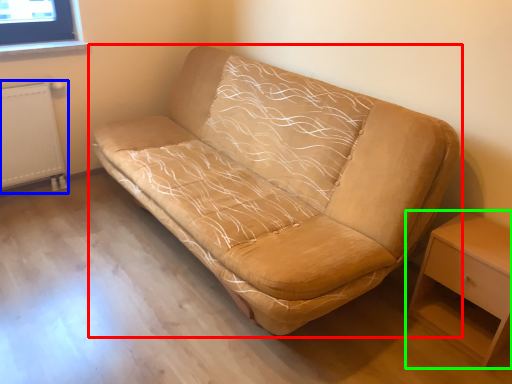
Question: Which object is the farthest from studio couch (highlighted by a red box)? Choose among these: radiator (highlighted by a blue box) or nightstand (highlighted by a green box).

Choices:
 (A) radiator
 (B) nightstand

Answer: (A)